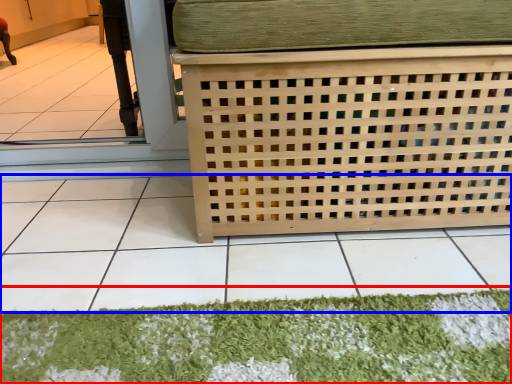
Question: Among these objects, which one is nearest to the camera, mat (highlighted by a red box) or tile (highlighted by a blue box)?

Choices:
 (A) mat
 (B) tile

Answer: (B)